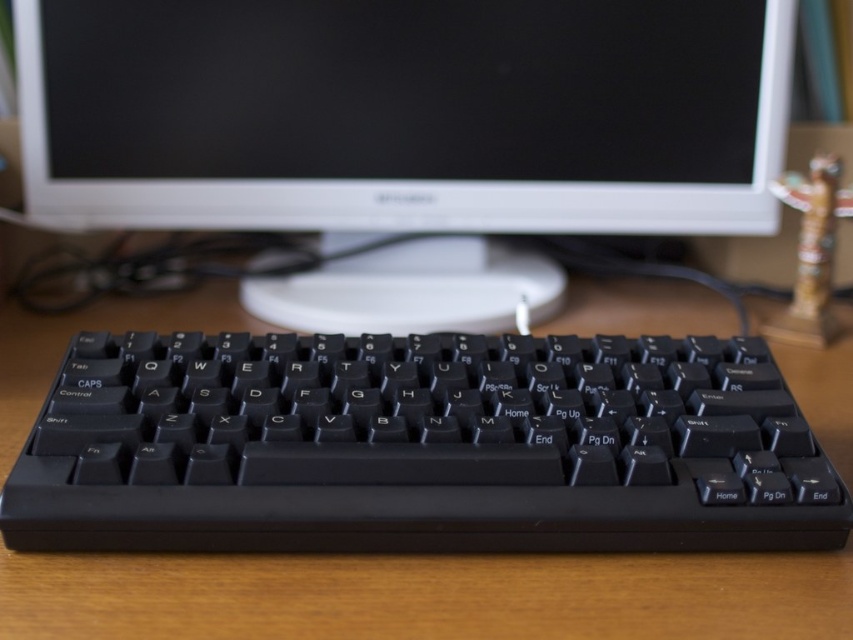
Does black matte monitor at upper center have a smaller size compared to black plastic keyboard at center?

No, black matte monitor at upper center is not smaller than black plastic keyboard at center.

Which is below, black matte monitor at upper center or black plastic keyboard at center?

black plastic keyboard at center

Locate an element on the screen. The height and width of the screenshot is (640, 853). black matte monitor at upper center is located at coordinates (405, 113).